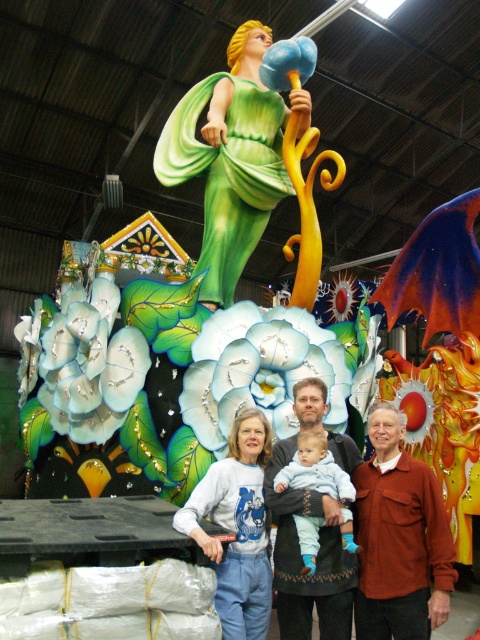
Question: Can you confirm if smooth green dress at center is positioned below light blue fleece at center?

Choices:
 (A) no
 (B) yes

Answer: (A)

Question: Is matte brown shirt at center closer to the viewer compared to matte gray sweater at center?

Choices:
 (A) no
 (B) yes

Answer: (B)

Question: Which object is closer to the camera taking this photo?

Choices:
 (A) matte gray sweater at center
 (B) white matte sweatshirt at center
 (C) light blue fleece at center

Answer: (B)

Question: Which of these objects is positioned closest to the dark brown leather jacket at center?

Choices:
 (A) matte gray sweater at center
 (B) light blue fleece at center

Answer: (A)

Question: Which of the following is the closest to the observer?

Choices:
 (A) (434, 570)
 (B) (288, 440)
 (C) (305, 396)

Answer: (A)

Question: Is matte brown shirt at center in front of matte gray sweater at center?

Choices:
 (A) no
 (B) yes

Answer: (B)